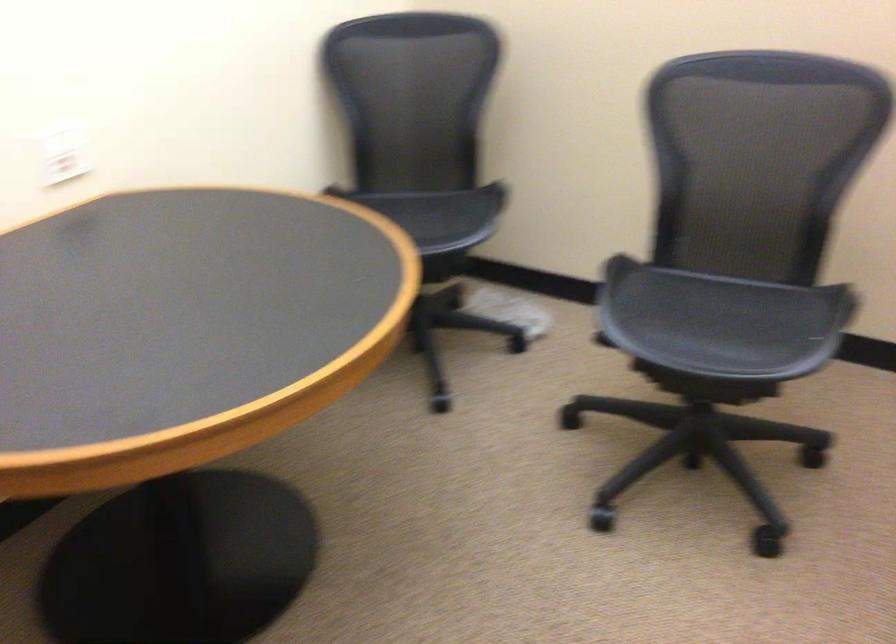
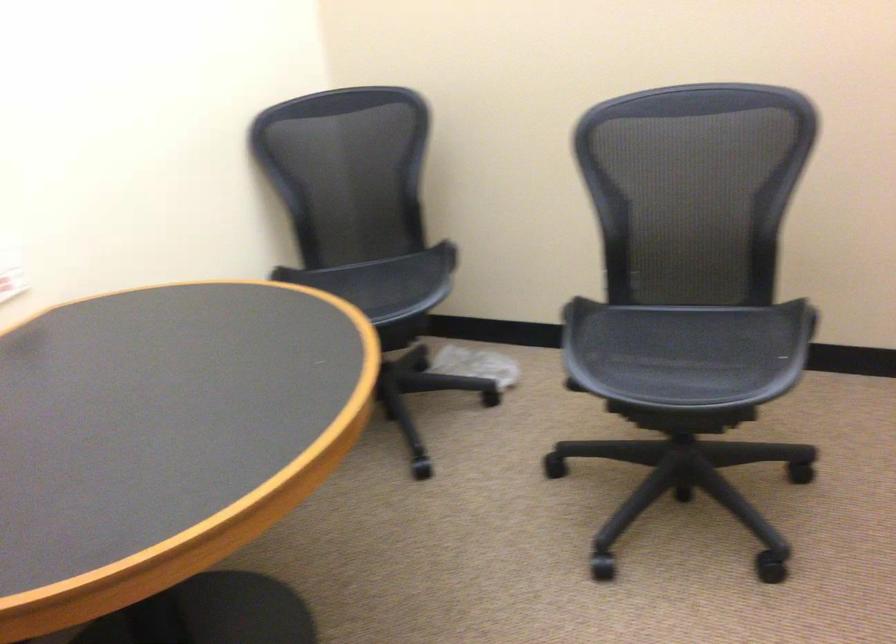
Locate, in the second image, the point that corresponds to pixel 431 214 in the first image.

(384, 281)